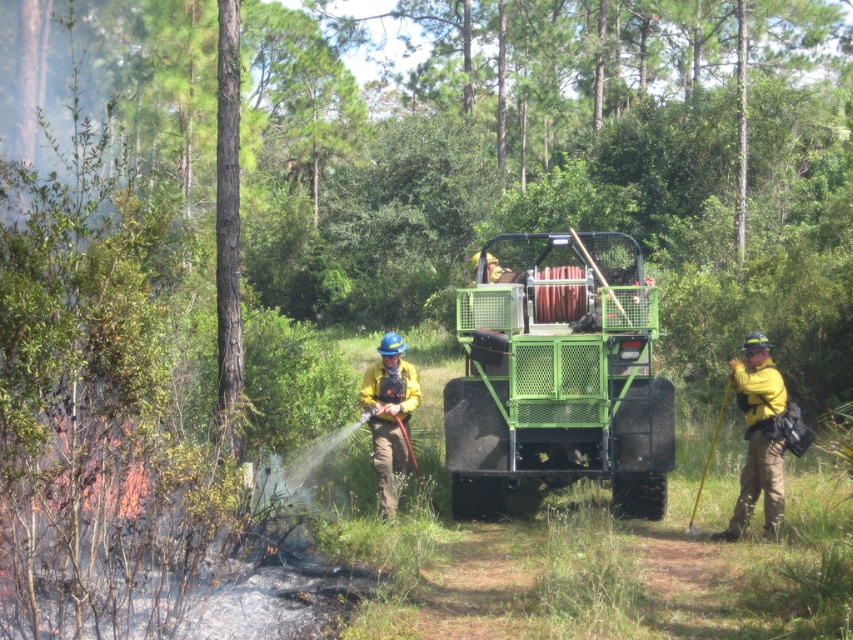
Question: Where is yellow hard hat at right located in relation to yellow fabric fireman at center in the image?

Choices:
 (A) right
 (B) left

Answer: (A)

Question: Does yellow hard hat at right appear under yellow fabric fireman at center?

Choices:
 (A) no
 (B) yes

Answer: (B)

Question: Which point is farther to the camera?

Choices:
 (A) yellow fabric fireman at center
 (B) yellow hard hat at right

Answer: (A)

Question: Does yellow hard hat at right appear on the right side of yellow fabric fireman at center?

Choices:
 (A) no
 (B) yes

Answer: (B)